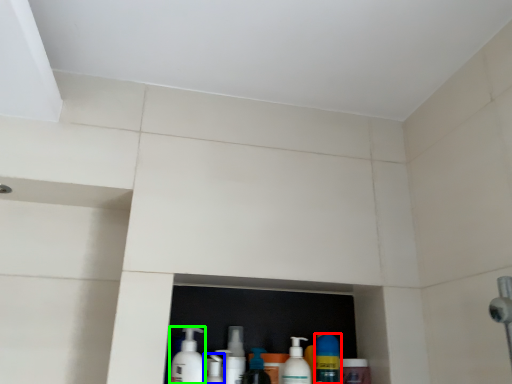
Question: Which is farther away from cleaning product (highlighted by a red box)? cleaning product (highlighted by a blue box) or cleaning product (highlighted by a green box)?

Choices:
 (A) cleaning product
 (B) cleaning product

Answer: (B)